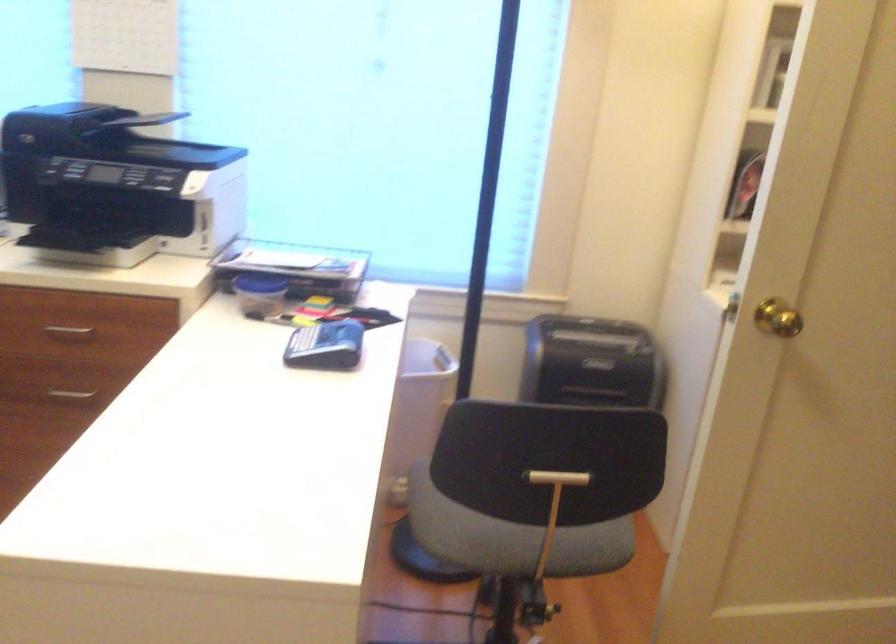
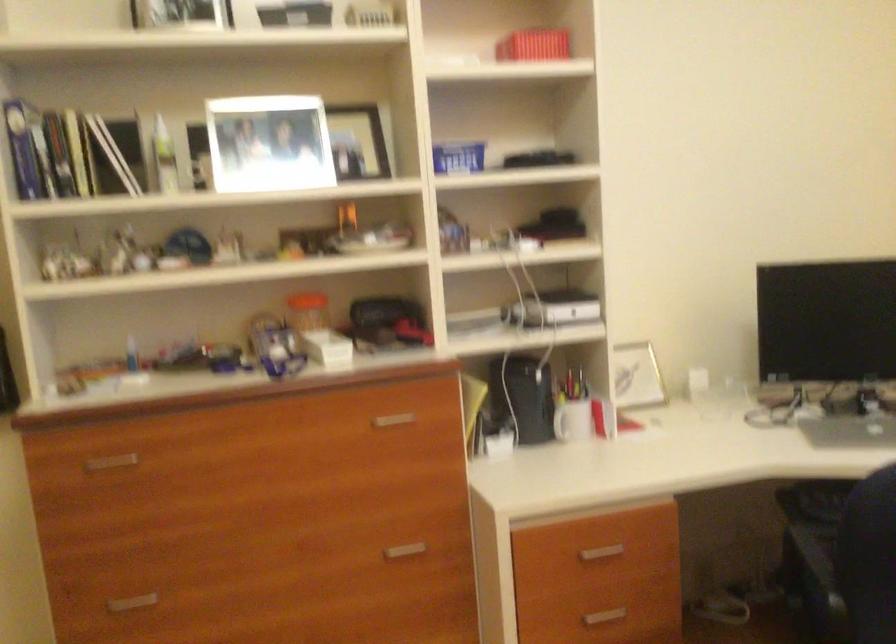
Question: The images are taken continuously from a first-person perspective. In which direction is your viewpoint rotating?

Choices:
 (A) Left
 (B) Right
 (C) Up
 (D) Down

Answer: (A)